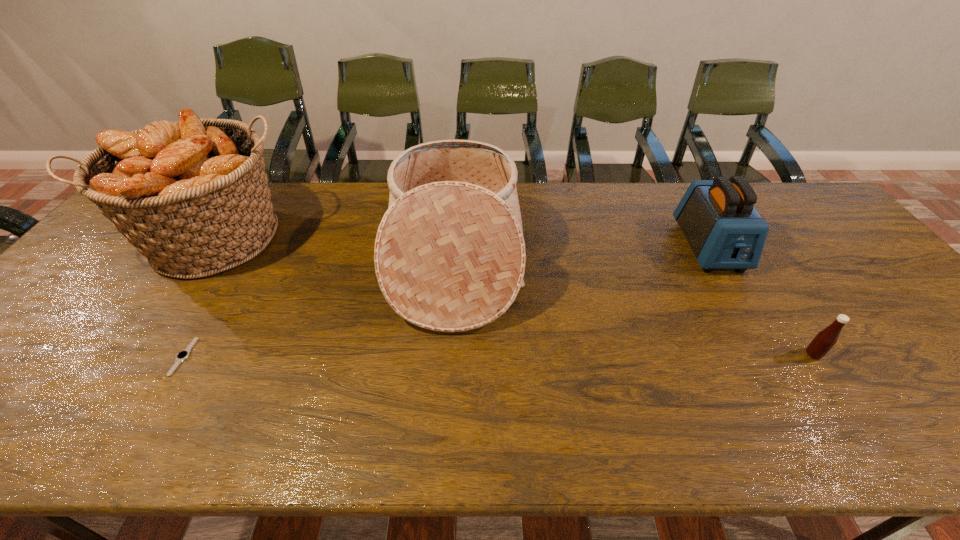
Identify the location of vacant space located 0.320m on the front-facing side of the fourth object from left to right. (784, 377).

You are a GUI agent. You are given a task and a screenshot of the screen. Output one action in this format:
    pyautogui.click(x=<x>, y=<y>)
    Task: Click on the vacant space situated on the right of the fourth tallest object
    
    Given the screenshot: What is the action you would take?
    pyautogui.click(x=900, y=354)

Where is `vacant space positioned on the back of the watch`? Image resolution: width=960 pixels, height=540 pixels. vacant space positioned on the back of the watch is located at coordinates (212, 307).

Image resolution: width=960 pixels, height=540 pixels. Find the location of `toaster situated at the far edge`. toaster situated at the far edge is located at coordinates (724, 230).

Find the location of a particular element. The width and height of the screenshot is (960, 540). object located at the left edge is located at coordinates (192, 196).

Where is `object present at the far left corner`? The height and width of the screenshot is (540, 960). object present at the far left corner is located at coordinates click(192, 196).

Image resolution: width=960 pixels, height=540 pixels. What are the coordinates of `free space at the far edge of the desktop` in the screenshot? It's located at (602, 208).

The width and height of the screenshot is (960, 540). Find the location of `free space at the near edge of the desktop`. free space at the near edge of the desktop is located at coordinates (830, 432).

The width and height of the screenshot is (960, 540). I want to click on vacant space at the left edge of the desktop, so click(130, 274).

You are a GUI agent. You are given a task and a screenshot of the screen. Output one action in this format:
    pyautogui.click(x=<x>, y=<y>)
    Task: Click on the vacant space at the right edge of the desktop
    Image resolution: width=960 pixels, height=540 pixels.
    Given the screenshot: What is the action you would take?
    pyautogui.click(x=847, y=266)